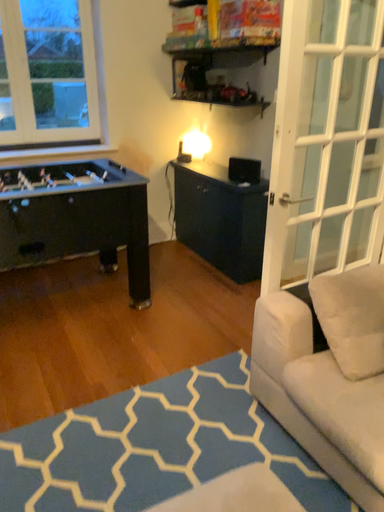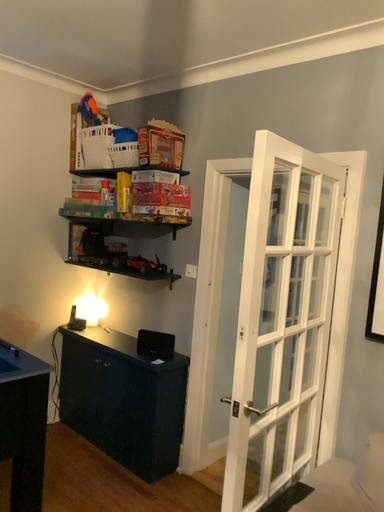
Question: How did the camera likely rotate when shooting the video?

Choices:
 (A) rotated right
 (B) rotated left

Answer: (A)